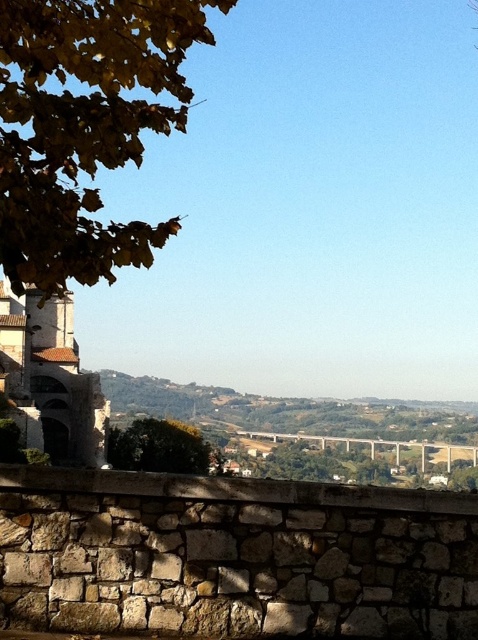
You are an architect designing a new garden layout. You need to place a statue in the garden such that it is visible from both the stone wall and the modern bridge. Considering the positions of the yellow leafy branch at upper left and the green leafy tree at center, where should you position the statue to ensure it is not obstructed by either?

The yellow leafy branch at upper left is positioned over the green leafy tree at center. To ensure the statue is visible from both the stone wall and the modern bridge without obstruction, place it between the two trees, closer to the stone wall, so it remains below the branch and outside the tree canopy.

You are standing at the vantage point overlooking the valley and want to reach the yellow leafy branch at upper left. Given that the distance between you and the branch is 20.16 meters, can you estimate whether you can comfortably walk to it without any obstacles?

The yellow leafy branch at upper left is 20.16 meters away from the viewer. Since there are no obstacles mentioned in the scene description, you can comfortably walk to it.

You are standing at the vantage point overlooking the valley and notice the yellow leafy branch at upper left. Based on its position in the image, can you determine if it is closer to the foreground stone wall or the distant bridge?

The yellow leafy branch at upper left is located at point (85, 128), which places it closer to the foreground stone wall than the distant bridge.